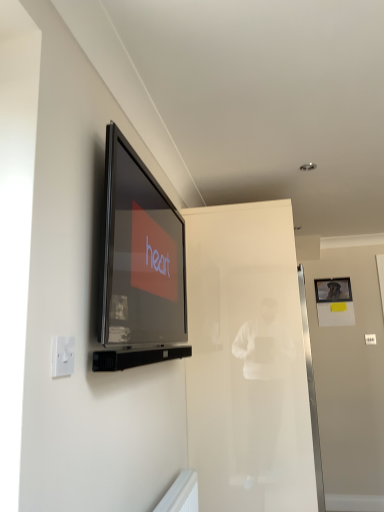
Question: Considering the relative sizes of transparent glass door at center and white plastic electric outlet at lower left in the image provided, is transparent glass door at center shorter than white plastic electric outlet at lower left?

Choices:
 (A) yes
 (B) no

Answer: (B)

Question: Would you say transparent glass door at center is outside white plastic electric outlet at lower left?

Choices:
 (A) no
 (B) yes

Answer: (B)

Question: Considering the relative positions of transparent glass door at center and white plastic electric outlet at lower left in the image provided, is transparent glass door at center to the right of white plastic electric outlet at lower left from the viewer's perspective?

Choices:
 (A) no
 (B) yes

Answer: (B)

Question: Is transparent glass door at center not near white plastic electric outlet at lower left?

Choices:
 (A) no
 (B) yes

Answer: (B)

Question: Is the depth of transparent glass door at center less than that of white plastic electric outlet at lower left?

Choices:
 (A) no
 (B) yes

Answer: (A)

Question: From the image's perspective, is transparent glass door at center located above or below white plastic electric outlet at lower left?

Choices:
 (A) above
 (B) below

Answer: (B)

Question: Is point (236, 487) positioned closer to the camera than point (71, 345)?

Choices:
 (A) farther
 (B) closer

Answer: (A)

Question: Is transparent glass door at center taller or shorter than white plastic electric outlet at lower left?

Choices:
 (A) short
 (B) tall

Answer: (B)

Question: Looking at the image, does transparent glass door at center seem bigger or smaller compared to white plastic electric outlet at lower left?

Choices:
 (A) big
 (B) small

Answer: (A)

Question: Is matte black television at upper left spatially inside white plastic electric outlet at lower left, or outside of it?

Choices:
 (A) inside
 (B) outside

Answer: (B)

Question: Is matte black television at upper left in front of or behind white plastic electric outlet at lower left in the image?

Choices:
 (A) front
 (B) behind

Answer: (B)

Question: From a real-world perspective, is matte black television at upper left above or below white plastic electric outlet at lower left?

Choices:
 (A) below
 (B) above

Answer: (B)

Question: Is matte black television at upper left to the left or to the right of white plastic electric outlet at lower left in the image?

Choices:
 (A) left
 (B) right

Answer: (B)

Question: In terms of height, does matte black television at upper left look taller or shorter compared to metallic silver picture frame at upper right?

Choices:
 (A) tall
 (B) short

Answer: (A)

Question: Considering the positions of matte black television at upper left and metallic silver picture frame at upper right in the image, is matte black television at upper left bigger or smaller than metallic silver picture frame at upper right?

Choices:
 (A) small
 (B) big

Answer: (B)